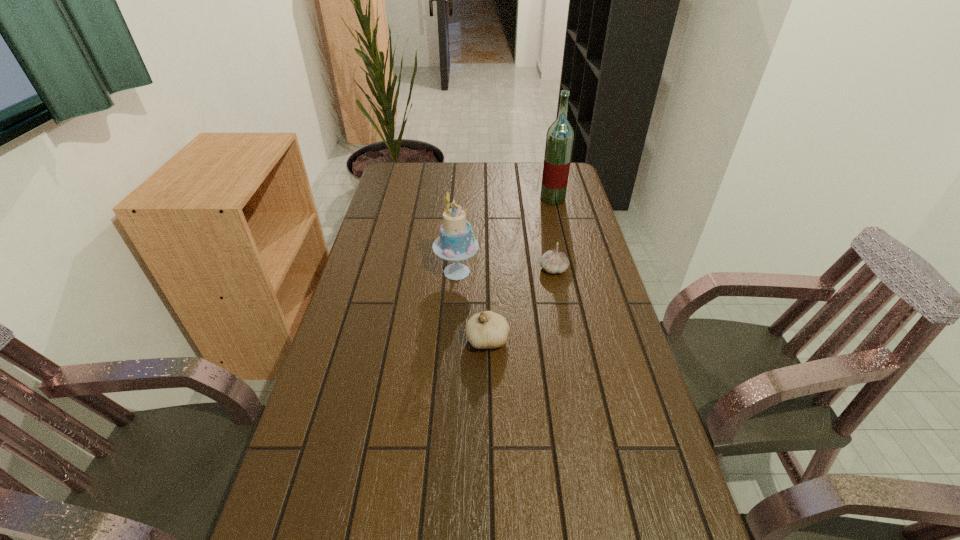
Identify the location of vacant region between the farther garlic and the third shortest object. (505, 271).

Image resolution: width=960 pixels, height=540 pixels. What are the coordinates of `free space between the farther garlic and the liquor` in the screenshot? It's located at (553, 234).

Locate an element on the screen. Image resolution: width=960 pixels, height=540 pixels. vacant space that is in between the farther garlic and the second tallest object is located at coordinates (505, 271).

Find the location of a particular element. The width and height of the screenshot is (960, 540). free point between the nearest object and the tallest object is located at coordinates (520, 269).

Identify the location of empty space that is in between the farthest object and the third shortest object. This screenshot has width=960, height=540. (505, 235).

Identify which object is the third closest to the second tallest object. Please provide its 2D coordinates. Your answer should be formatted as a tuple, i.e. [(x, y)], where the tuple contains the x and y coordinates of a point satisfying the conditions above.

[(559, 140)]

Identify which object is the closest to the nearer garlic. Please provide its 2D coordinates. Your answer should be formatted as a tuple, i.e. [(x, y)], where the tuple contains the x and y coordinates of a point satisfying the conditions above.

[(456, 242)]

Where is `vacant space that satisfies the following two spatial constraints: 1. on the back side of the farther garlic; 2. on the right side of the left garlic`? The image size is (960, 540). vacant space that satisfies the following two spatial constraints: 1. on the back side of the farther garlic; 2. on the right side of the left garlic is located at coordinates (487, 269).

Locate an element on the screen. This screenshot has width=960, height=540. vacant space that satisfies the following two spatial constraints: 1. with a ladder on the side of the nearest object; 2. on the left side of the cake is located at coordinates (452, 340).

Locate an element on the screen. The width and height of the screenshot is (960, 540). vacant area that satisfies the following two spatial constraints: 1. with a ladder on the side of the cake; 2. on the left side of the nearest object is located at coordinates (452, 340).